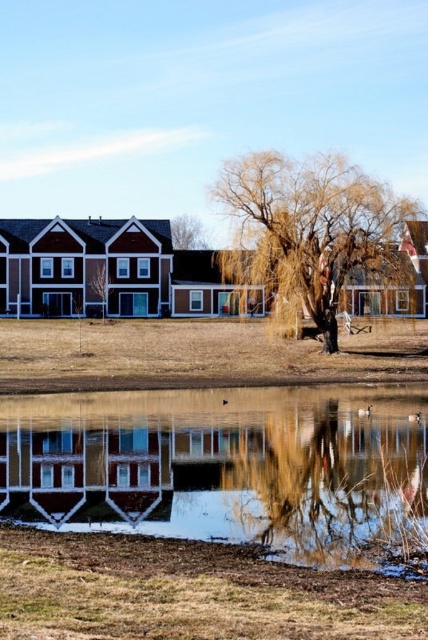
Can you confirm if reflective glass puddle at lower center is positioned to the right of brown textured tree at upper center?

Indeed, reflective glass puddle at lower center is positioned on the right side of brown textured tree at upper center.

Which is behind, point (134, 460) or point (184, 218)?

The point (184, 218) is more distant.

The image size is (428, 640). What do you see at coordinates (226, 468) in the screenshot?
I see `reflective glass puddle at lower center` at bounding box center [226, 468].

Identify the location of reflective glass puddle at lower center. This screenshot has height=640, width=428. (226, 468).

Does point (410, 500) come behind point (255, 163)?

No, it is not.

Between reflective glass puddle at lower center and dry grass at center, which one appears on the left side from the viewer's perspective?

Positioned to the left is reflective glass puddle at lower center.

Describe the element at coordinates (226, 468) in the screenshot. The image size is (428, 640). I see `reflective glass puddle at lower center` at that location.

Find the location of `reflective glass puddle at lower center`. reflective glass puddle at lower center is located at coordinates (226, 468).

Is dry grass at center further to camera compared to brown textured tree at upper center?

No.

Does dry grass at center have a greater height compared to brown textured tree at upper center?

Yes.

Who is more forward, (261, 218) or (171, 220)?

Point (261, 218) is more forward.

Identify the location of dry grass at center. The height and width of the screenshot is (640, 428). click(312, 227).